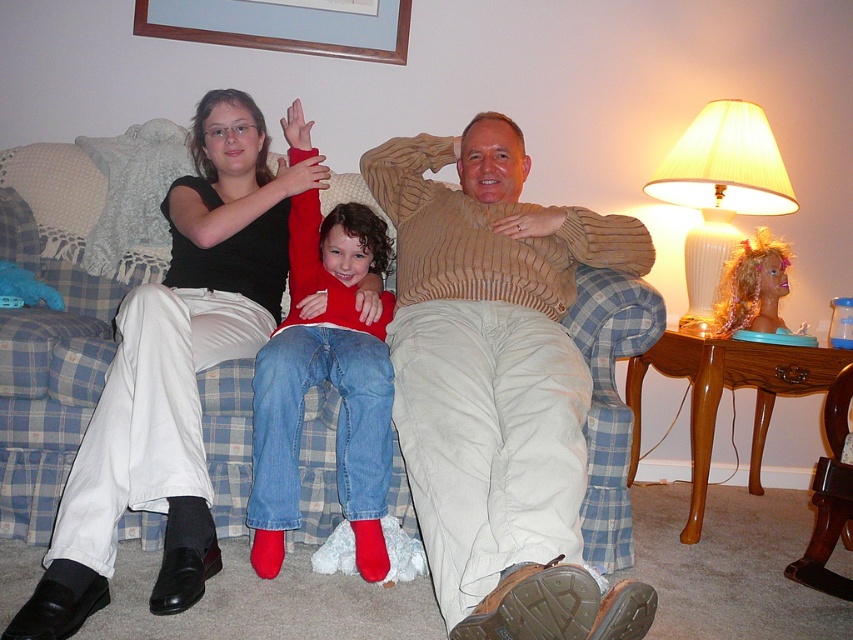
In the scene shown: Does matte black shoes at lower left have a lesser height compared to matte black shirt at upper left?

Yes, matte black shoes at lower left is shorter than matte black shirt at upper left.

Can you confirm if matte black shoes at lower left is positioned below matte black shirt at upper left?

Yes.

Does point (358, 266) come behind point (248, 342)?

Yes, point (358, 266) is farther from viewer.

Find the location of a particular element. The height and width of the screenshot is (640, 853). matte black shoes at lower left is located at coordinates (215, 360).

Between point (502, 285) and point (383, 22), which one is positioned in front?

Point (502, 285) is in front.

Is knitted beige sweater at center wider than wooden picture frame at upper center?

No.

Which is in front, point (421, 396) or point (383, 10)?

Point (421, 396)

Locate an element on the screen. The image size is (853, 640). knitted beige sweater at center is located at coordinates (498, 385).

Is knitted beige sweater at center further to camera compared to matte black shirt at upper left?

No, knitted beige sweater at center is in front of matte black shirt at upper left.

Can you confirm if knitted beige sweater at center is positioned to the right of matte black shirt at upper left?

Indeed, knitted beige sweater at center is positioned on the right side of matte black shirt at upper left.

Where is `knitted beige sweater at center`? Image resolution: width=853 pixels, height=640 pixels. knitted beige sweater at center is located at coordinates (498, 385).